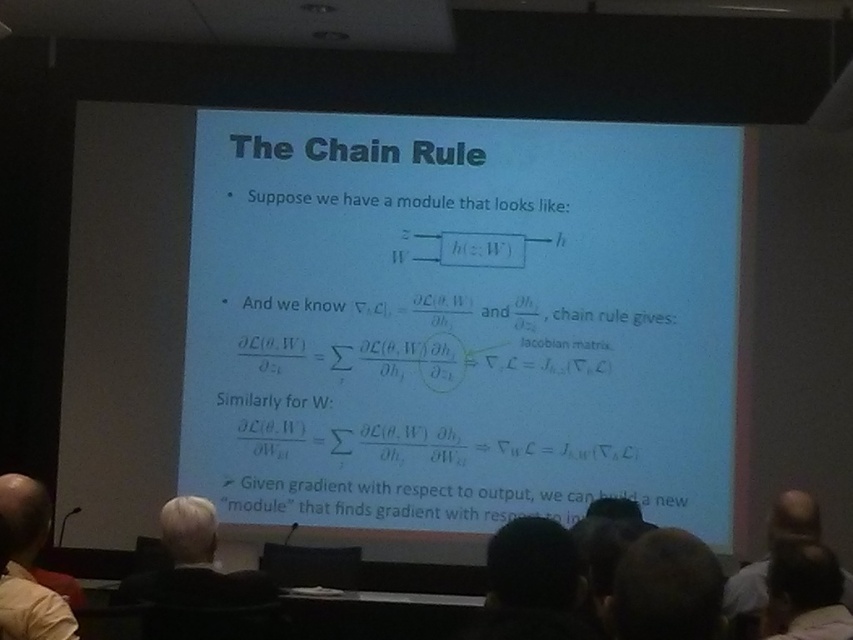
Question: Considering the real-world distances, which object is closest to the white paper at center?

Choices:
 (A) brown hair at upper right
 (B) light beige shirt at lower left
 (C) gray hair at lower right
 (D) white hair at upper left

Answer: (D)

Question: Is light beige shirt at lower left bigger than brown hair at upper right?

Choices:
 (A) no
 (B) yes

Answer: (B)

Question: Does white paper at center have a greater width compared to white hair at upper left?

Choices:
 (A) yes
 (B) no

Answer: (A)

Question: Which is nearer to the white hair at upper left?

Choices:
 (A) brown hair at upper right
 (B) gray hair at lower right

Answer: (A)

Question: Which of the following is the farthest from the observer?

Choices:
 (A) (171, 628)
 (B) (19, 509)
 (C) (779, 580)

Answer: (B)

Question: Observing the image, what is the correct spatial positioning of white paper at center in reference to white hair at upper left?

Choices:
 (A) below
 (B) above

Answer: (B)